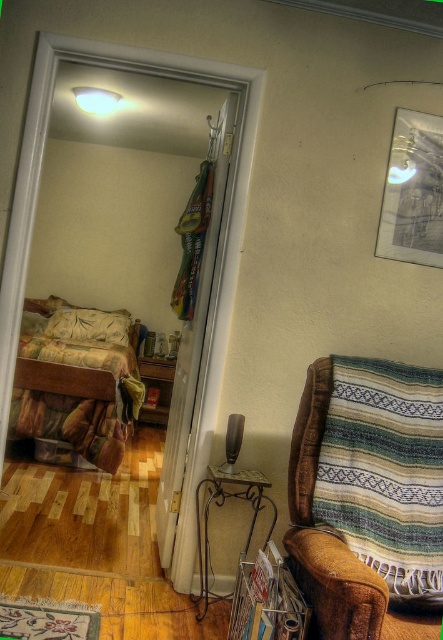
Question: Which of the following is the closest to the observer?

Choices:
 (A) fluffy beige pillow at left
 (B) brown plush armchair at right

Answer: (B)

Question: Which point appears farthest from the camera in this image?

Choices:
 (A) (37, 316)
 (B) (302, 445)
 (C) (111, 92)
 (D) (391, 140)

Answer: (A)

Question: Can you confirm if brown plush armchair at right is positioned to the right of white glossy lampshade at upper center?

Choices:
 (A) no
 (B) yes

Answer: (B)

Question: Among these points, which one is nearest to the camera?

Choices:
 (A) (108, 460)
 (B) (115, 104)
 (C) (435, 253)
 (D) (63, 332)

Answer: (C)

Question: Can you confirm if floral fabric couch at left is bigger than white glossy lampshade at upper center?

Choices:
 (A) yes
 (B) no

Answer: (A)

Question: Is brown plush armchair at right below fluffy beige pillow at left?

Choices:
 (A) no
 (B) yes

Answer: (B)